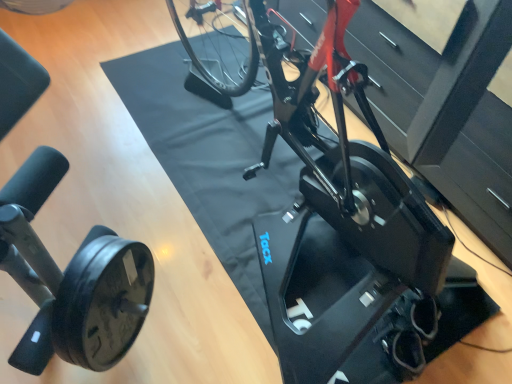
Question: Visually, is black matte stationary bicycle at center, marked as the 1th stationary bicycle in a right-to-left arrangement, positioned to the left or to the right of black rubber stationary bicycle at lower left, marked as the second stationary bicycle in a back-to-front arrangement?

Choices:
 (A) right
 (B) left

Answer: (A)

Question: Is black matte stationary bicycle at center, the 2th stationary bicycle viewed from the front, wider or thinner than black rubber stationary bicycle at lower left, which is the first stationary bicycle in left-to-right order?

Choices:
 (A) thin
 (B) wide

Answer: (B)

Question: Which is farther from the black matte stationary bicycle at center, which ranks as the second stationary bicycle in left-to-right order?

Choices:
 (A) black rubber stationary bicycle at lower left, which is the first stationary bicycle in left-to-right order
 (B) black rubber wheel at lower left

Answer: (A)

Question: Estimate the real-world distances between objects in this image. Which object is farther from the black rubber wheel at lower left?

Choices:
 (A) black matte stationary bicycle at center, marked as the 1th stationary bicycle in a right-to-left arrangement
 (B) black rubber stationary bicycle at lower left, which is the first stationary bicycle in left-to-right order

Answer: (A)